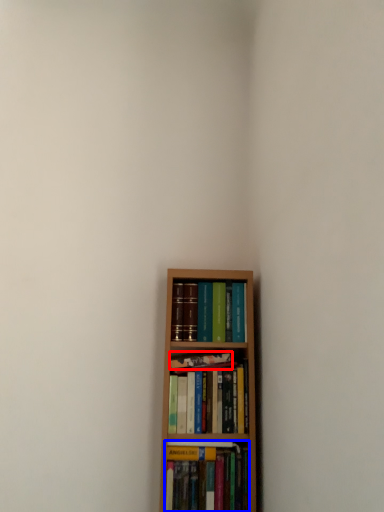
Question: Which point is further to the camera, book (highlighted by a red box) or book (highlighted by a blue box)?

Choices:
 (A) book
 (B) book

Answer: (A)